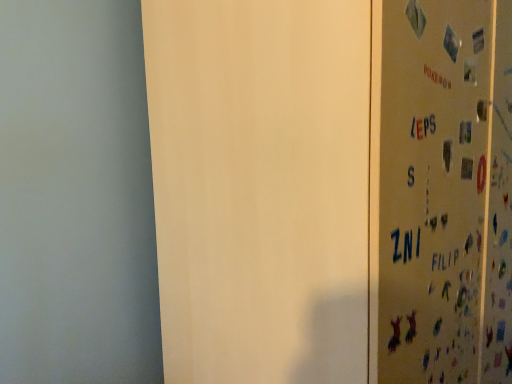
Find the location of a particular element. The image size is (512, 384). white matte screen door at right is located at coordinates (260, 187).

What do you see at coordinates (260, 187) in the screenshot? I see `white matte screen door at right` at bounding box center [260, 187].

Where is `white matte screen door at right`? The height and width of the screenshot is (384, 512). white matte screen door at right is located at coordinates (260, 187).